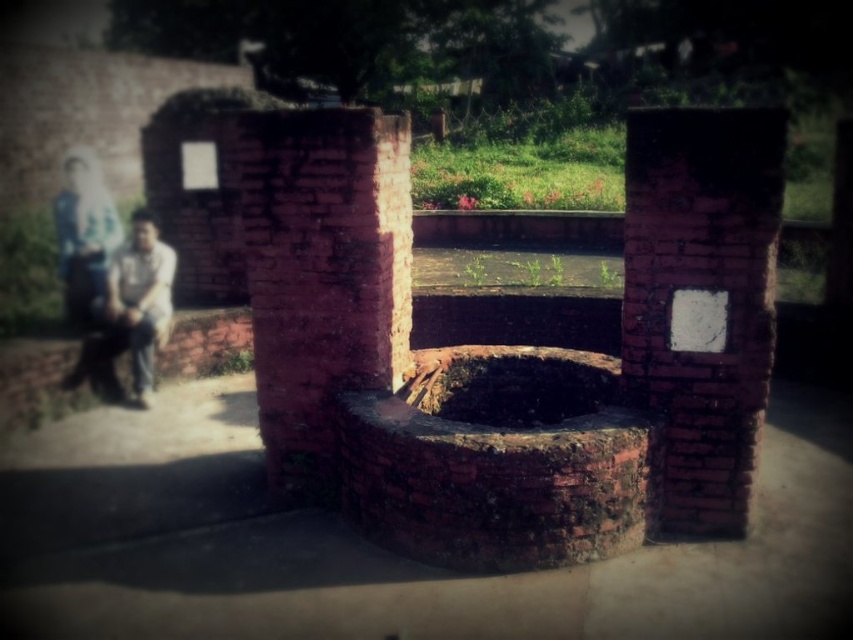
You are standing at the entrance of the well area and see the rusty brick fire pit at center and the light brown leather jacket at left. Which object is positioned lower in the scene?

The rusty brick fire pit at center is located below the light brown leather jacket at left, so it is positioned lower in the scene.

You are standing at the entrance of the well area and see the red brick pillar at center and the light brown leather jacket at left. Which object is taller?

The red brick pillar at center is taller than the light brown leather jacket at left.

You are standing in front of the well and notice the red brick pillar at center and the light brown leather jacket at left. Which object is nearer to you?

The red brick pillar at center is closer to the viewer than the light brown leather jacket at left.